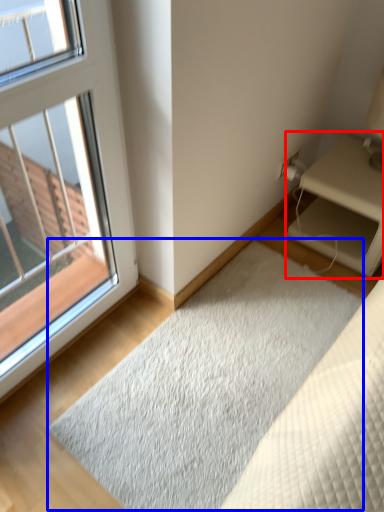
Question: Among these objects, which one is farthest to the camera, nightstand (highlighted by a red box) or doormat (highlighted by a blue box)?

Choices:
 (A) nightstand
 (B) doormat

Answer: (A)